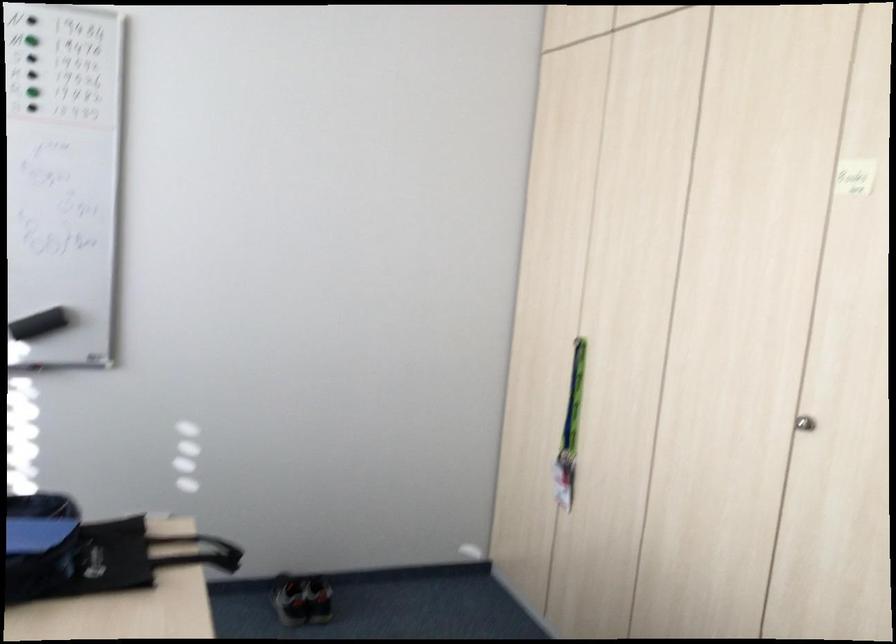
Describe the element at coordinates (805, 424) in the screenshot. I see `a silver door knob` at that location.